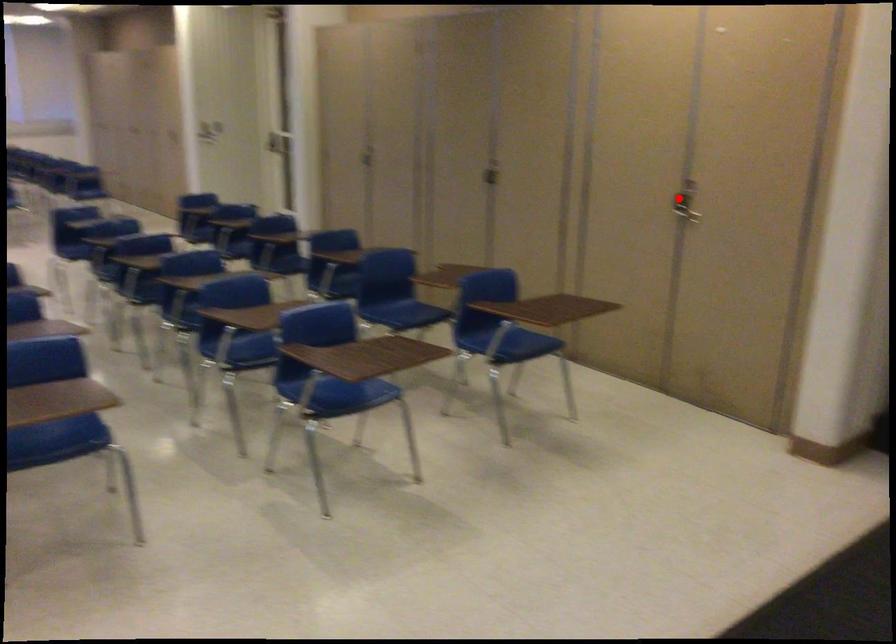
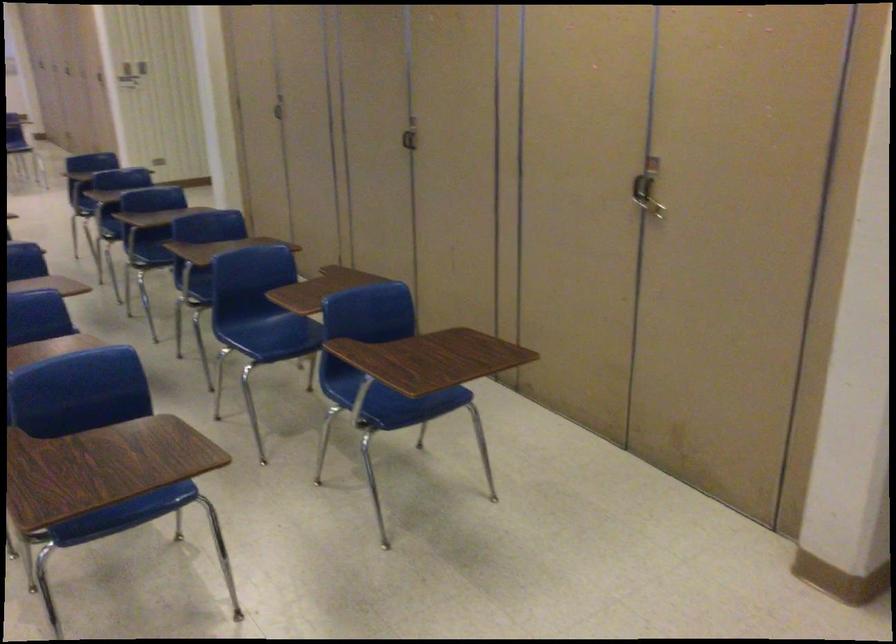
Question: I am providing you with two images of the same scene from different viewpoints. Given a red point in image1, look at the same physical point in image2. Is it:

Choices:
 (A) Closer to the viewpoint
 (B) Farther from the viewpoint

Answer: (A)